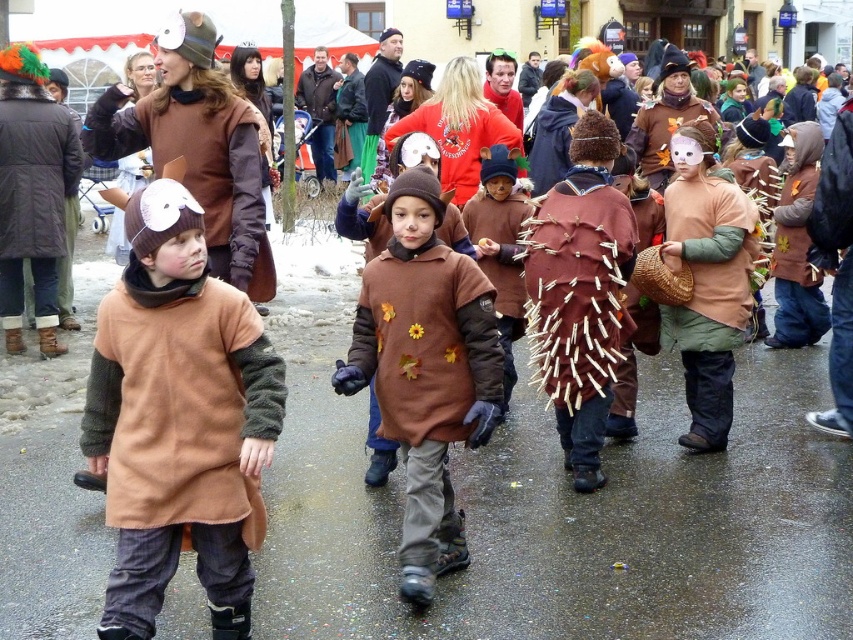
You are a photographer trying to capture a group photo of the children in the scene. You notice two costumes at the center of the image, a brown felt dress at center and a matte brown costume at center. To ensure both are visible in the photo, which costume should you position closer to the front?

The brown felt dress at center is shorter than the matte brown costume at center, so positioning the brown felt dress at center closer to the front will ensure both are visible in the photo.

Looking at this image, you are a photographer at the event and want to capture both the matte brown dress at center and the matte brown costume at center in a single shot. Which one will appear taller in the photo?

The matte brown costume at center appears taller than the matte brown dress at center in the photo because the matte brown dress at center is shorter than the matte brown costume at center.

You are a photographer trying to capture a group photo of the children in the festive event. You notice the brown felt dress at center and the matte brown costume at center are 7.38 feet apart. Can you fit both into your camera frame if your camera has a maximum width of 8 feet?

The brown felt dress at center and the matte brown costume at center are 7.38 feet apart. Since the distance between them is less than the camera frame width of 8 feet, you can fit both into the camera frame.